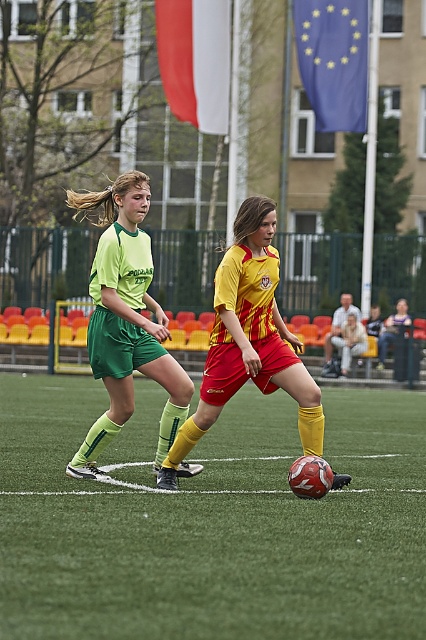
Does green artificial turf at center have a larger size compared to blue fabric flag at upper center?

Indeed, green artificial turf at center has a larger size compared to blue fabric flag at upper center.

Is point (126, 627) farther from camera compared to point (311, 97)?

That is False.

Locate an element on the screen. This screenshot has height=640, width=426. green artificial turf at center is located at coordinates (210, 522).

Does matte green shorts at center have a greater width compared to white fabric flag at upper center?

No, matte green shorts at center is not wider than white fabric flag at upper center.

Who is shorter, matte green shorts at center or white fabric flag at upper center?

With less height is matte green shorts at center.

Which is behind, point (106, 256) or point (195, 67)?

Point (195, 67)

In order to click on matte green shorts at center in this screenshot , I will do `click(126, 321)`.

What do you see at coordinates (249, 339) in the screenshot? The height and width of the screenshot is (640, 426). I see `yellow/red striped jersey at center` at bounding box center [249, 339].

Is point (229, 348) farther from viewer compared to point (353, 26)?

No, (229, 348) is in front of (353, 26).

Is point (218, 312) positioned before point (328, 60)?

Yes, point (218, 312) is closer to viewer.

The image size is (426, 640). What are the coordinates of `yellow/red striped jersey at center` in the screenshot? It's located at (249, 339).